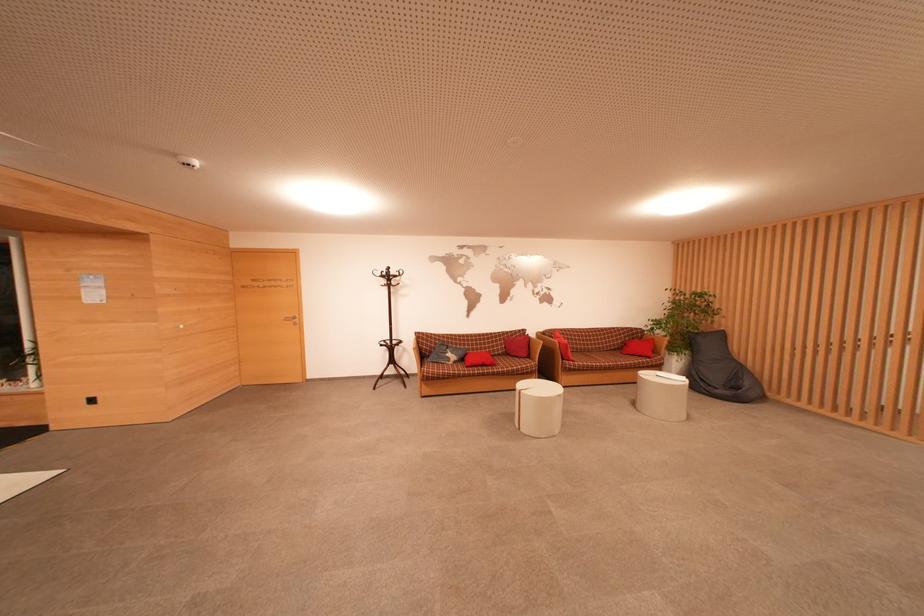
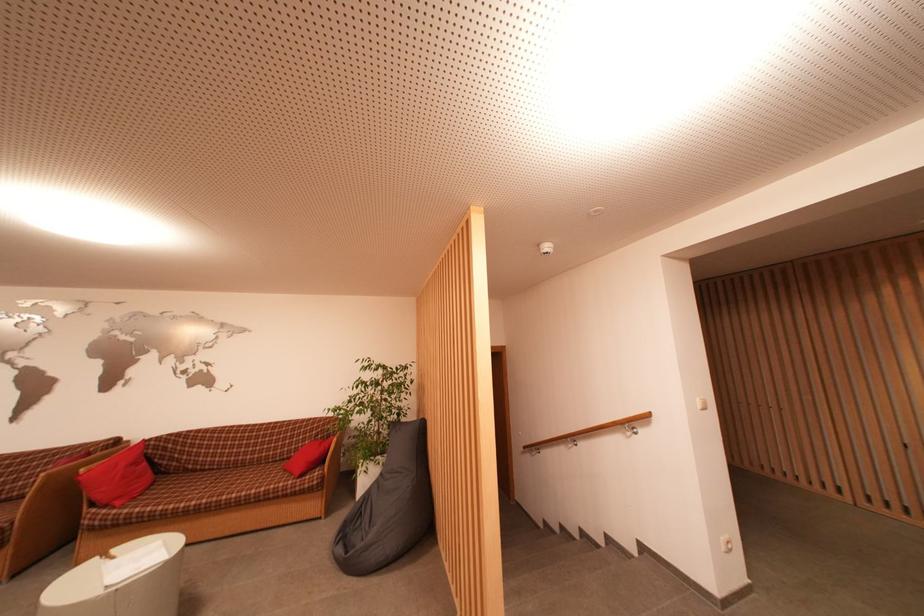
In the second image, find the point that corresponds to (x=637, y=342) in the first image.

(333, 439)